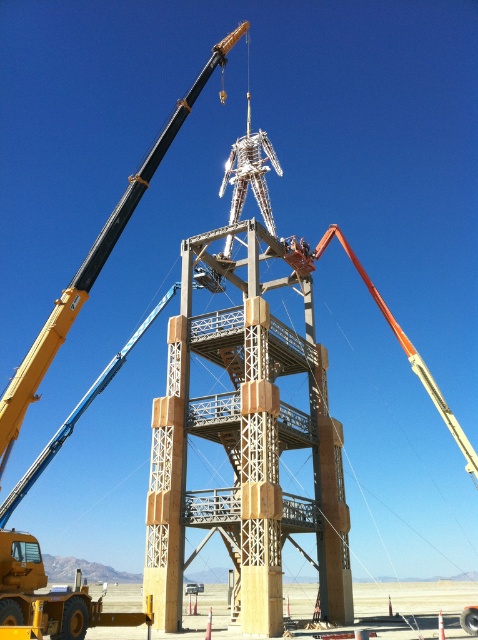
Is point (220, 257) positioned after point (32, 344)?

No, it is in front of (32, 344).

Does brown wooden tower at center appear under yellow metallic crane arm at upper left?

Indeed, brown wooden tower at center is positioned under yellow metallic crane arm at upper left.

Between point (319, 513) and point (6, 394), which one is positioned behind?

Positioned behind is point (319, 513).

The image size is (478, 640). What are the coordinates of `brown wooden tower at center` in the screenshot? It's located at (245, 444).